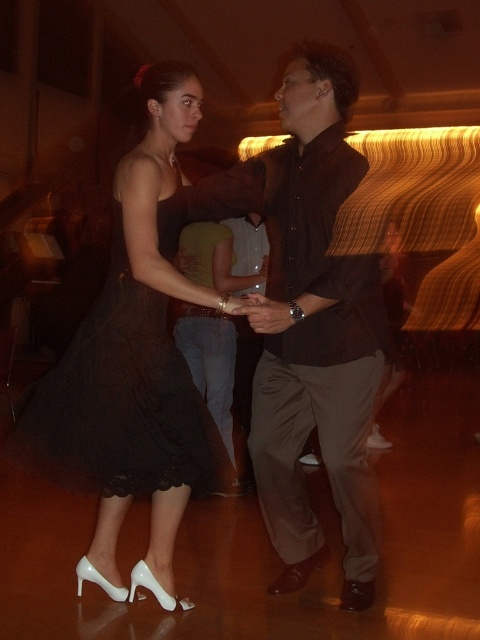
Looking at this image, you are a photographer at the event and want to capture a closeup of the black lace dress at center and the brown matte shirt at center. Which one will appear larger in the photo?

The black lace dress at center will appear larger in the photo because it is closer to the viewer than the brown matte shirt at center.